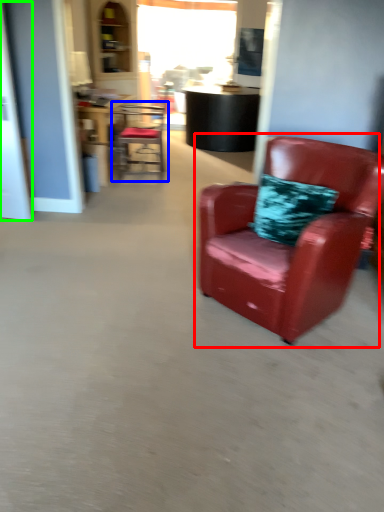
Question: Considering the real-world distances, which object is farthest from chair (highlighted by a red box)? chair (highlighted by a blue box) or glass door (highlighted by a green box)?

Choices:
 (A) chair
 (B) glass door

Answer: (A)